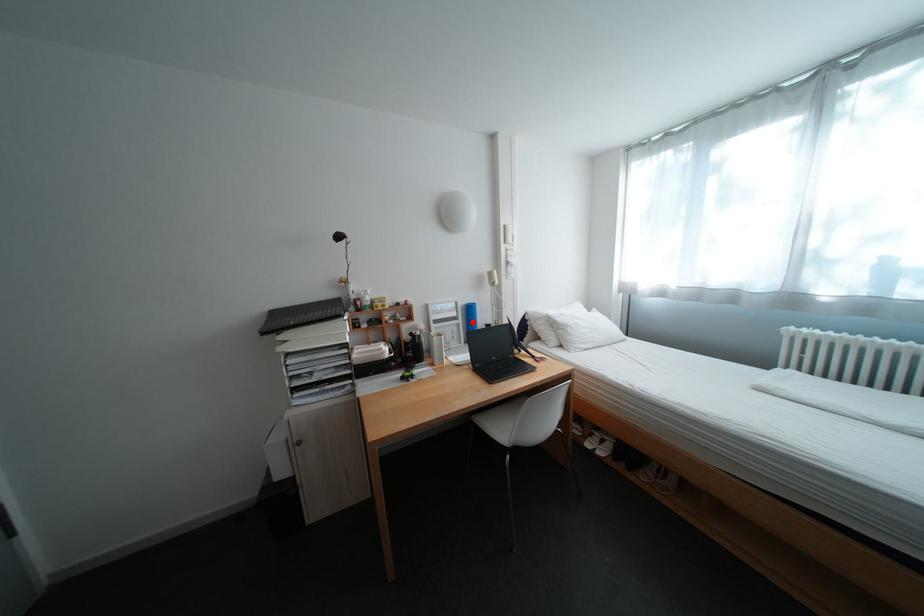
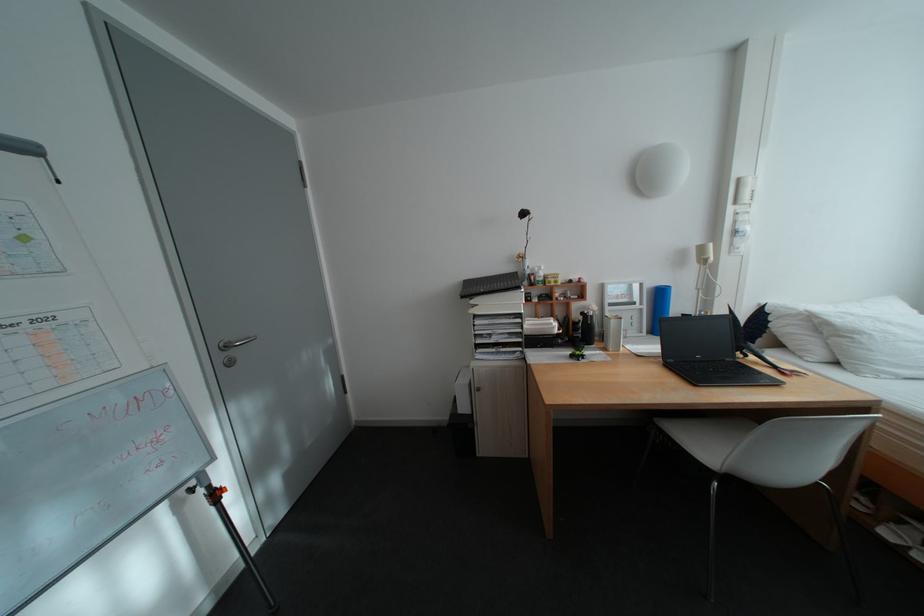
Where in the second image is the point corresponding to the highlighted location from the first image?

(657, 307)